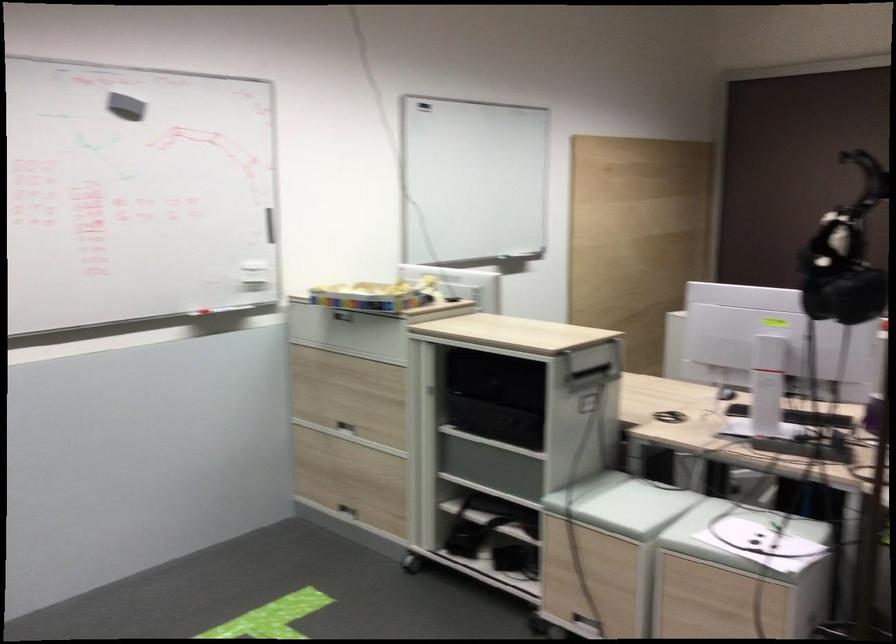
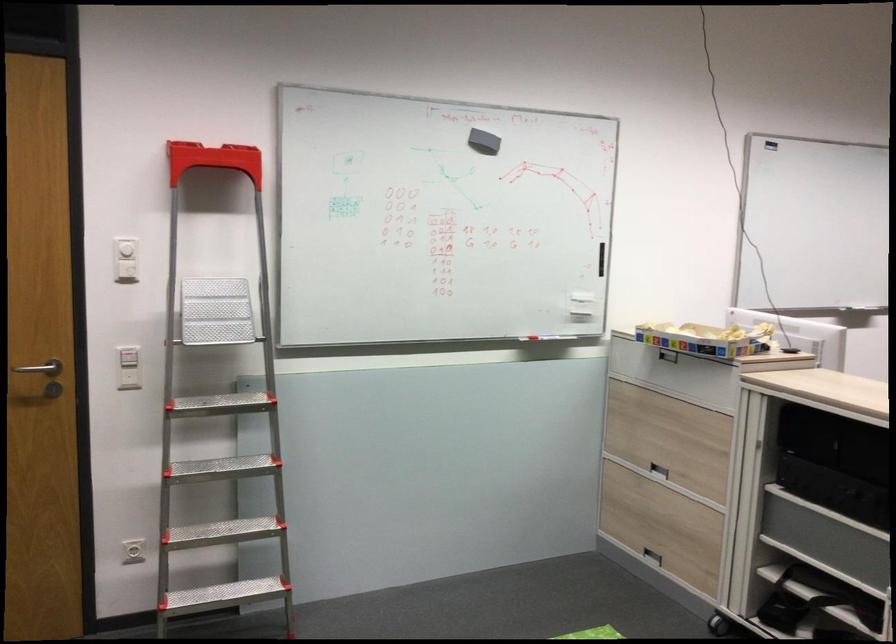
In the second image, find the point that corresponds to (218,314) in the first image.

(539, 337)